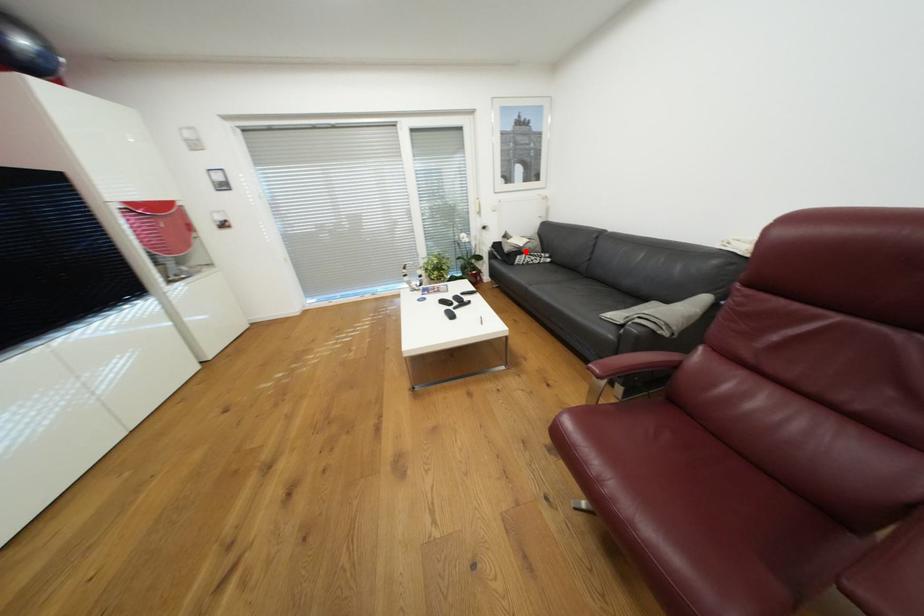
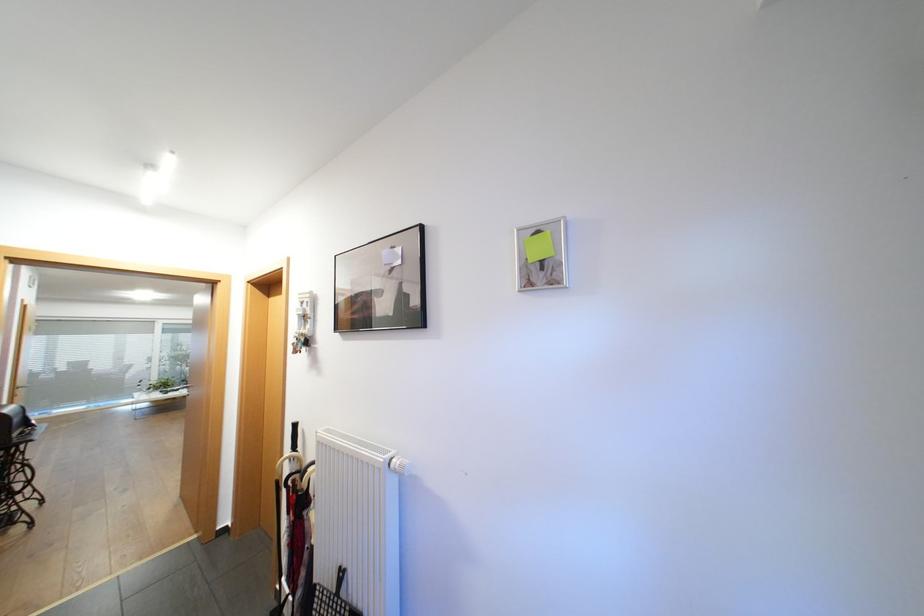
Question: I am providing you with two images of the same scene from different viewpoints. A red point is marked on the first image. At the location where the point appears in image 1, is it still visible in image 2?

Choices:
 (A) Yes
 (B) No

Answer: (B)